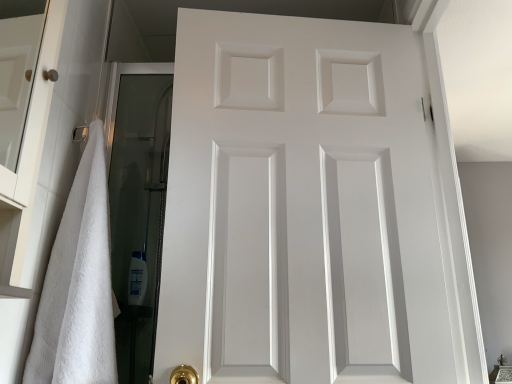
Question: From the image's perspective, is white fluffy towel at left beneath white glossy shampoo bottle at lower left?

Choices:
 (A) no
 (B) yes

Answer: (A)

Question: Could white glossy shampoo bottle at lower left be considered to be inside white fluffy towel at left?

Choices:
 (A) no
 (B) yes

Answer: (A)

Question: Does white fluffy towel at left have a larger size compared to white glossy shampoo bottle at lower left?

Choices:
 (A) yes
 (B) no

Answer: (A)

Question: Can you confirm if white fluffy towel at left is wider than white glossy shampoo bottle at lower left?

Choices:
 (A) yes
 (B) no

Answer: (A)

Question: Is white fluffy towel at left outside white glossy shampoo bottle at lower left?

Choices:
 (A) no
 (B) yes

Answer: (B)

Question: From a real-world perspective, is white fluffy towel at left physically above white glossy shampoo bottle at lower left?

Choices:
 (A) yes
 (B) no

Answer: (A)

Question: Does white fluffy towel at left have a greater width compared to white matte door at center?

Choices:
 (A) yes
 (B) no

Answer: (A)

Question: Is white fluffy towel at left facing away from white matte door at center?

Choices:
 (A) yes
 (B) no

Answer: (B)

Question: Does white fluffy towel at left have a smaller size compared to white matte door at center?

Choices:
 (A) no
 (B) yes

Answer: (B)

Question: Is white fluffy towel at left touching white matte door at center?

Choices:
 (A) yes
 (B) no

Answer: (B)

Question: Is white matte door at center inside white fluffy towel at left?

Choices:
 (A) yes
 (B) no

Answer: (B)

Question: Can you confirm if white fluffy towel at left is thinner than white matte door at center?

Choices:
 (A) yes
 (B) no

Answer: (B)

Question: Is white matte door at center at the left side of white fluffy towel at left?

Choices:
 (A) yes
 (B) no

Answer: (B)